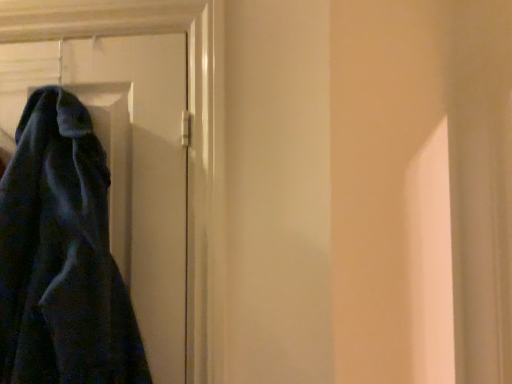
What is the approximate height of dark blue fabric at left?

dark blue fabric at left is 23.73 inches in height.

What do you see at coordinates (128, 163) in the screenshot? I see `dark blue fabric at left` at bounding box center [128, 163].

Image resolution: width=512 pixels, height=384 pixels. In order to click on dark blue fabric at left in this screenshot , I will do `click(128, 163)`.

Identify the location of dark blue fabric at left. (128, 163).